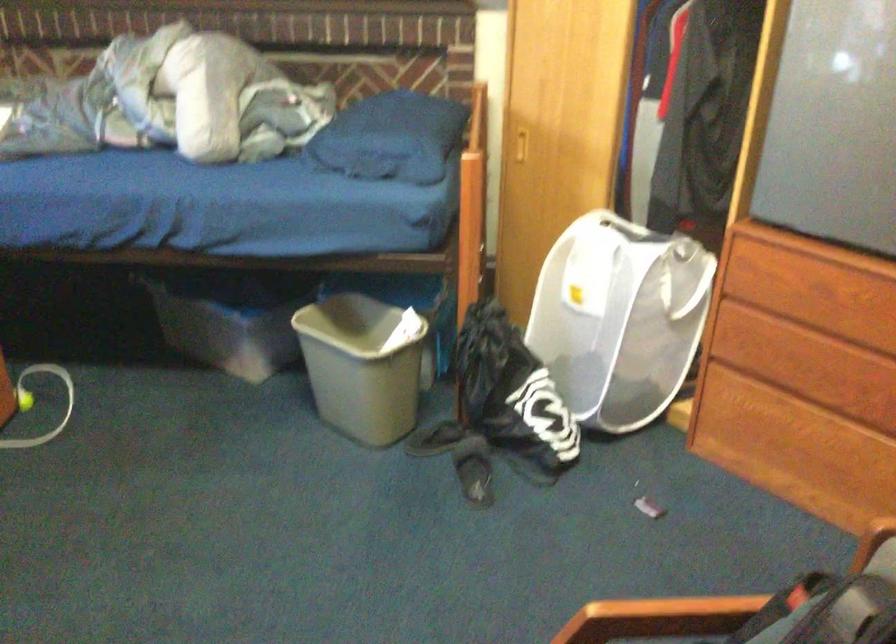
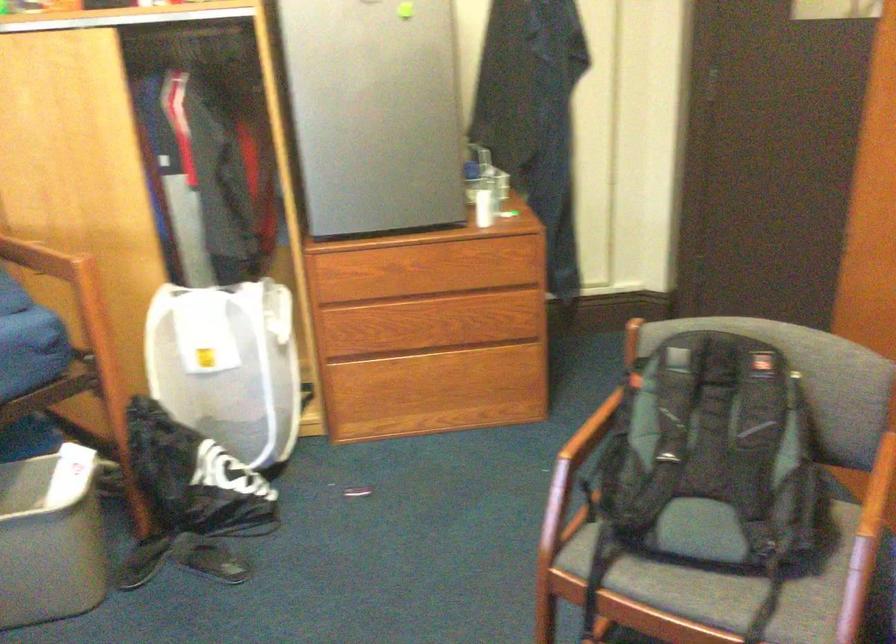
Find the pixel in the second image that matches [597,313] in the first image.

(228, 365)